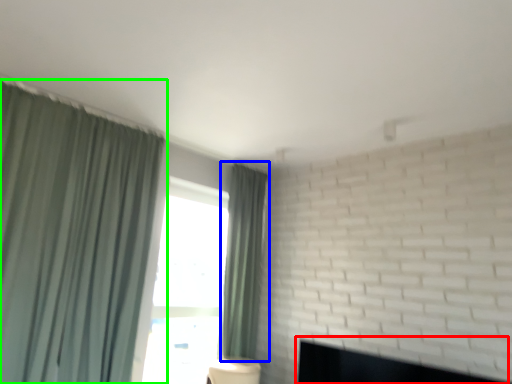
Question: Which is farther away from fireplace (highlighted by a red box)? curtain (highlighted by a blue box) or curtain (highlighted by a green box)?

Choices:
 (A) curtain
 (B) curtain

Answer: (B)